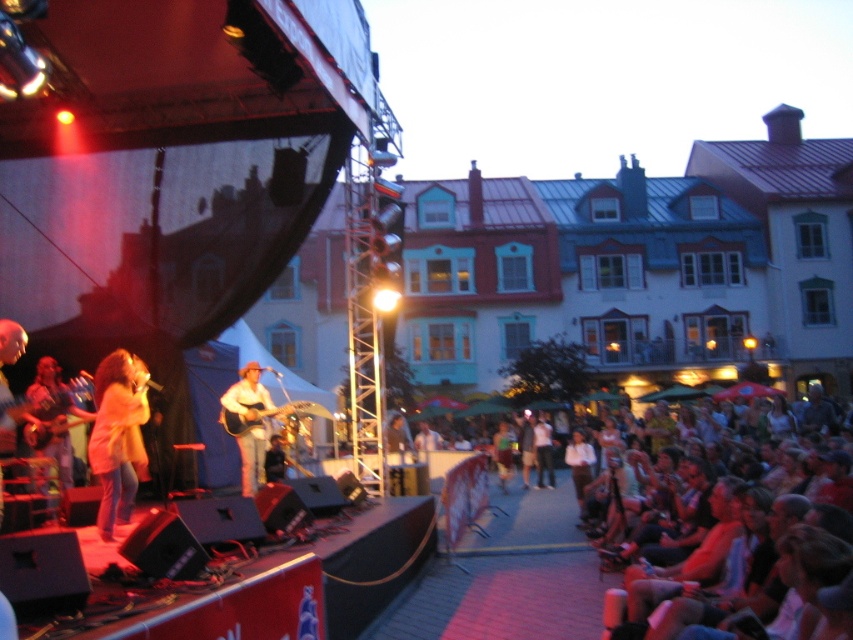
Consider the image. Does white cotton shirt at lower right have a greater height compared to light brown leather jacket at stage left?

Yes.

Can you confirm if white cotton shirt at lower right is positioned below light brown leather jacket at stage left?

Yes, white cotton shirt at lower right is below light brown leather jacket at stage left.

Is point (450, 580) more distant than point (105, 397)?

Yes, point (450, 580) is behind point (105, 397).

The height and width of the screenshot is (640, 853). In order to click on white cotton shirt at lower right in this screenshot , I will do `click(512, 577)`.

Does point (566, 548) come behind point (248, 486)?

No, (566, 548) is closer to viewer.

This screenshot has height=640, width=853. Identify the location of white cotton shirt at lower right. (512, 577).

Who is more distant from viewer, [94,452] or [247,472]?

The point [247,472] is more distant.

Is light brown leather jacket at stage left to the left of light brown acoustic guitar at center stage from the viewer's perspective?

Correct, you'll find light brown leather jacket at stage left to the left of light brown acoustic guitar at center stage.

Which is behind, point (144, 397) or point (233, 410)?

Positioned behind is point (233, 410).

Where is `light brown leather jacket at stage left`? The image size is (853, 640). light brown leather jacket at stage left is located at coordinates (117, 435).